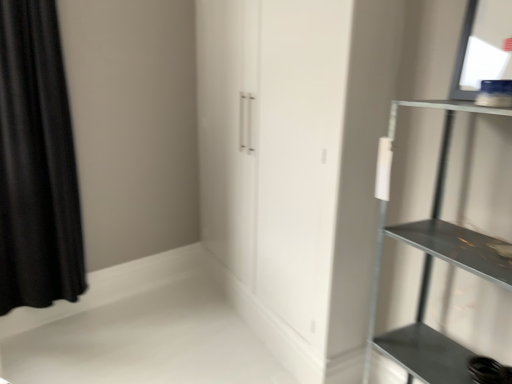
In order to click on vacant space in black velvet curtain at left (from a real-world perspective) in this screenshot , I will do [51, 314].